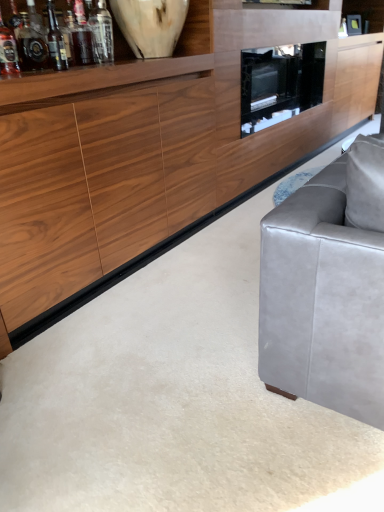
Question: Is translucent glass bottle at upper left, the third bottle from the left, to the right of wooden cabinet at center from the viewer's perspective?

Choices:
 (A) no
 (B) yes

Answer: (A)

Question: From the image's perspective, is translucent glass bottle at upper left, the third bottle from the left, on wooden cabinet at center?

Choices:
 (A) no
 (B) yes

Answer: (A)

Question: Is translucent glass bottle at upper left, the third bottle from the left, bigger than wooden cabinet at center?

Choices:
 (A) yes
 (B) no

Answer: (B)

Question: From a real-world perspective, is translucent glass bottle at upper left, the third bottle from the left, physically below wooden cabinet at center?

Choices:
 (A) yes
 (B) no

Answer: (B)

Question: Is translucent glass bottle at upper left, the third bottle from the left, smaller than wooden cabinet at center?

Choices:
 (A) yes
 (B) no

Answer: (A)

Question: Considering the relative sizes of translucent glass bottle at upper left, acting as the 2th bottle starting from the right, and wooden cabinet at center in the image provided, is translucent glass bottle at upper left, acting as the 2th bottle starting from the right, taller than wooden cabinet at center?

Choices:
 (A) yes
 (B) no

Answer: (B)

Question: From the image's perspective, is translucent glass wine bottle at upper left over black glass tv cabinet at center?

Choices:
 (A) yes
 (B) no

Answer: (B)

Question: Is black glass tv cabinet at center at the back of translucent glass wine bottle at upper left?

Choices:
 (A) yes
 (B) no

Answer: (B)

Question: Are translucent glass wine bottle at upper left and black glass tv cabinet at center far apart?

Choices:
 (A) no
 (B) yes

Answer: (B)

Question: Is translucent glass wine bottle at upper left outside of black glass tv cabinet at center?

Choices:
 (A) yes
 (B) no

Answer: (A)

Question: From the image's perspective, is translucent glass wine bottle at upper left located beneath black glass tv cabinet at center?

Choices:
 (A) no
 (B) yes

Answer: (B)

Question: Is translucent glass wine bottle at upper left at the right side of black glass tv cabinet at center?

Choices:
 (A) no
 (B) yes

Answer: (A)

Question: From the image's perspective, would you say wooden cabinet at center is shown under translucent glass bottle at upper left, the third bottle from the left?

Choices:
 (A) yes
 (B) no

Answer: (B)